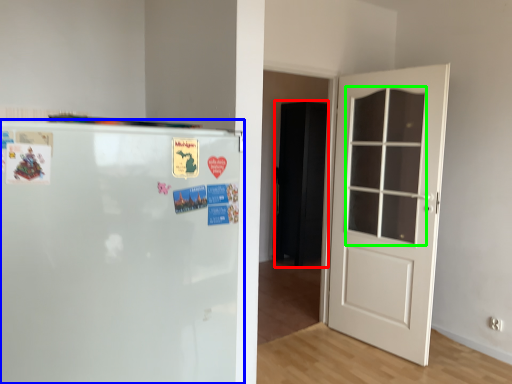
Question: Which is nearer to the armoire (highlighted by a red box)? refrigerator (highlighted by a blue box) or window (highlighted by a green box).

Choices:
 (A) refrigerator
 (B) window

Answer: (B)